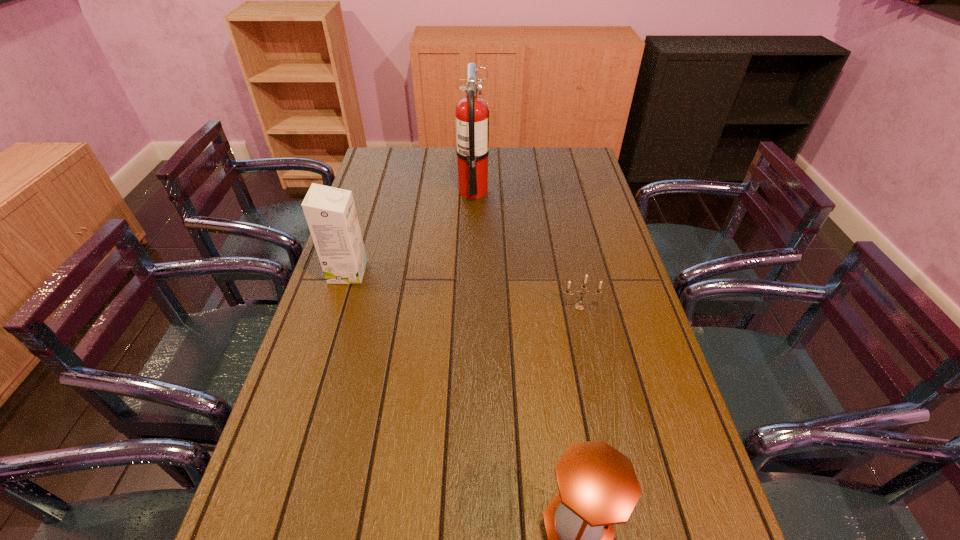
Find the location of `vacant space that's between the tallest object and the second nearest object`. vacant space that's between the tallest object and the second nearest object is located at coordinates (526, 249).

I want to click on object that is the second nearest to the hourglass, so click(330, 212).

Select which object is the closest to the third shortest object. Please provide its 2D coordinates. Your answer should be formatted as a tuple, i.e. [(x, y)], where the tuple contains the x and y coordinates of a point satisfying the conditions above.

[(472, 112)]

I want to click on vacant space that satisfies the following two spatial constraints: 1. on the nozzle side of the third farthest object; 2. on the left side of the farthest object, so [x=470, y=307].

Locate an element on the screen. free space that satisfies the following two spatial constraints: 1. on the back side of the second nearest object; 2. on the nozzle side of the third object from right to left is located at coordinates (554, 191).